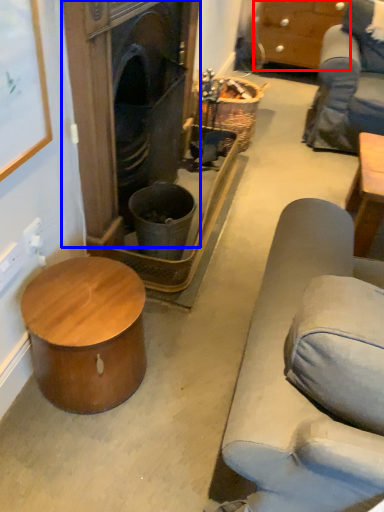
Question: Which object is closer to the camera taking this photo, cabinetry (highlighted by a red box) or fireplace (highlighted by a blue box)?

Choices:
 (A) cabinetry
 (B) fireplace

Answer: (B)